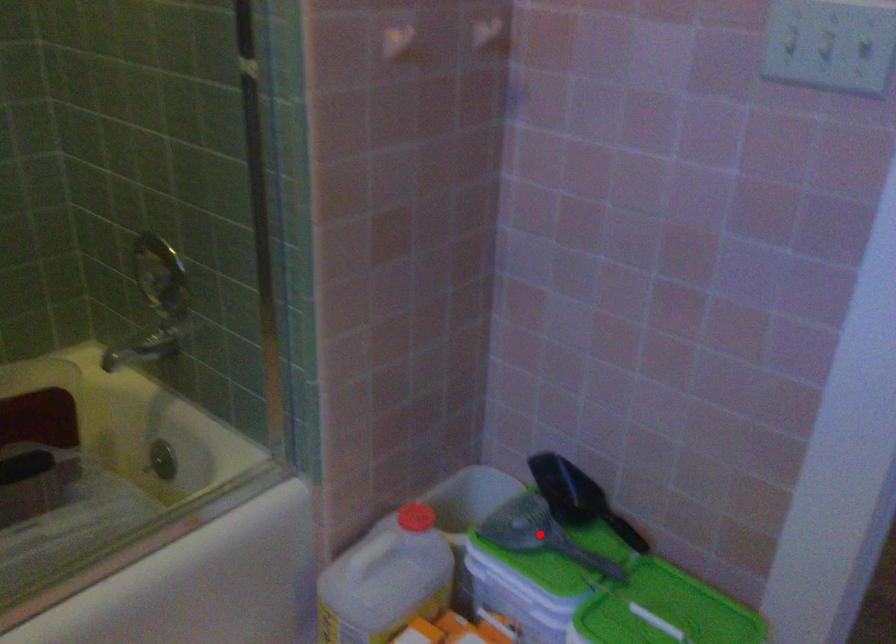
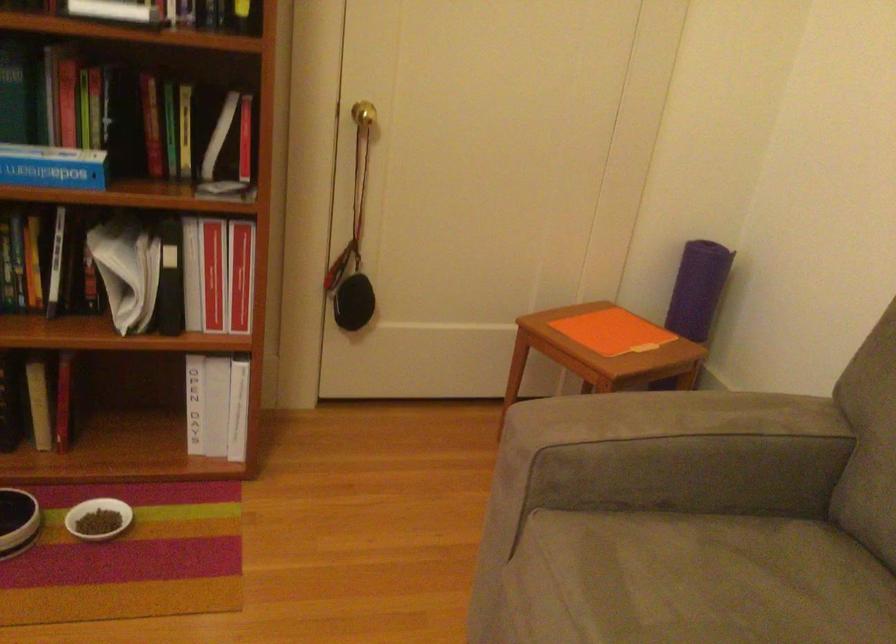
Question: I am providing you with two images of the same scene from different viewpoints. A red point is marked on the first image. At the location where the point appears in image 1, is it still visible in image 2?

Choices:
 (A) Yes
 (B) No

Answer: (B)